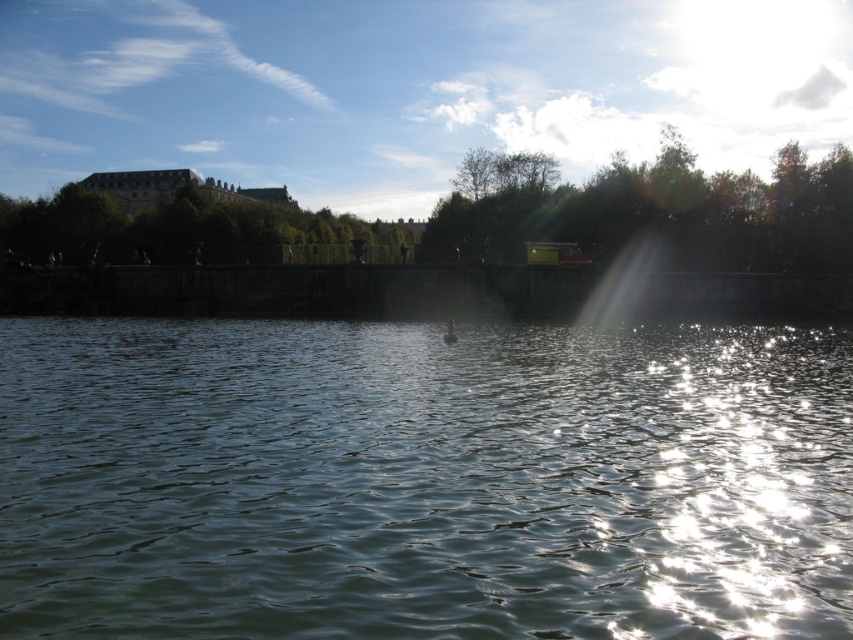
Does green leafy tree at upper right appear under green leafy tree at upper center?

No.

Does green leafy tree at upper right have a lesser width compared to green leafy tree at upper center?

No, green leafy tree at upper right is not thinner than green leafy tree at upper center.

Describe the element at coordinates (656, 211) in the screenshot. I see `green leafy tree at upper right` at that location.

Locate an element on the screen. This screenshot has width=853, height=640. green leafy tree at upper right is located at coordinates (656, 211).

Describe the element at coordinates (422, 481) in the screenshot. The image size is (853, 640). I see `clear water at center` at that location.

Find the location of a particular element. clear water at center is located at coordinates (422, 481).

Measure the distance from clear water at center to green leafy tree at upper right.

They are 139.60 feet apart.

Looking at this image, is clear water at center thinner than green leafy tree at upper right?

Yes, clear water at center is thinner than green leafy tree at upper right.

Does point (730, 508) come closer to viewer compared to point (822, 161)?

That is True.

Where is `clear water at center`? This screenshot has height=640, width=853. clear water at center is located at coordinates (422, 481).